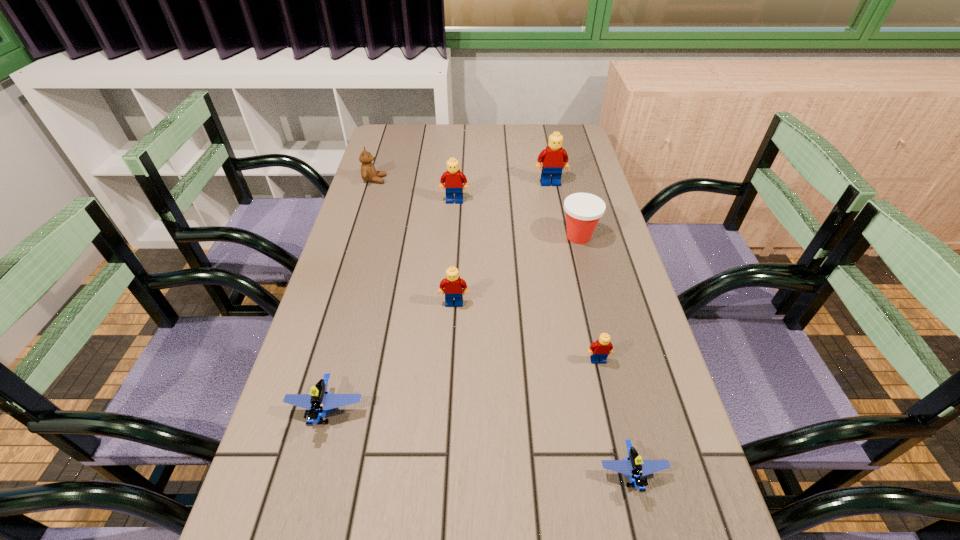
Where is `the farthest Lego`? the farthest Lego is located at coordinates point(554,159).

You are a GUI agent. You are given a task and a screenshot of the screen. Output one action in this format:
    pyautogui.click(x=<x>, y=<y>)
    Task: Click on the biggest yellow Lego
    
    Given the screenshot: What is the action you would take?
    pyautogui.click(x=554, y=159)

At what (x,y) coordinates should I click in order to perform the action: click on the second tallest object. Please return your answer as a coordinate pair (x, y). The image size is (960, 540). Looking at the image, I should click on (453, 178).

Where is `the third nearest yellow Lego`? The height and width of the screenshot is (540, 960). the third nearest yellow Lego is located at coordinates (453, 178).

I want to click on the third farthest Lego, so click(453, 286).

Locate an element on the screen. The width and height of the screenshot is (960, 540). the third biggest yellow Lego is located at coordinates (453, 286).

Locate an element on the screen. teddy bear is located at coordinates (368, 172).

The height and width of the screenshot is (540, 960). Identify the location of Dixie cup. (583, 210).

This screenshot has height=540, width=960. Identify the location of red-orange Dixie cup. click(583, 210).

Find the location of a particular element. The width and height of the screenshot is (960, 540). the seventh farthest object is located at coordinates (320, 400).